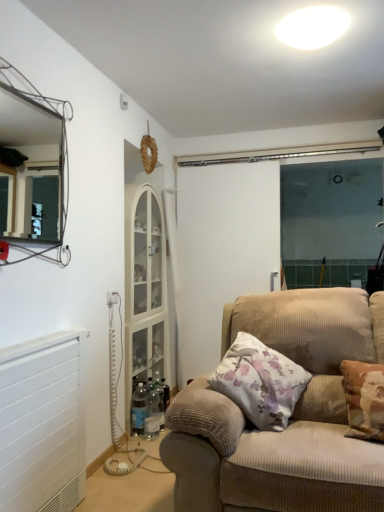
What do you see at coordinates (312, 27) in the screenshot?
I see `white glossy ceiling light at upper center` at bounding box center [312, 27].

This screenshot has height=512, width=384. What do you see at coordinates (31, 169) in the screenshot? I see `metallic wire frame mirror at upper left` at bounding box center [31, 169].

You are a GUI agent. You are given a task and a screenshot of the screen. Output one action in this format:
    pyautogui.click(x=<x>, y=<y>)
    Task: Click on the metallic wire frame mirror at upper left
    The height and width of the screenshot is (512, 384).
    Given the screenshot: What is the action you would take?
    pyautogui.click(x=31, y=169)

What do you see at coordinates (260, 382) in the screenshot?
I see `white floral cushion at right` at bounding box center [260, 382].

The width and height of the screenshot is (384, 512). Find the location of `white plastic radiator at lower left`. white plastic radiator at lower left is located at coordinates (43, 423).

Find the location of a particular element. This screenshot has height=512, width=384. white glossy ceiling light at upper center is located at coordinates (312, 27).

From a real-world perspective, does beige corduroy couch at center stand above white plastic radiator at lower left?

Yes, from a real-world perspective, beige corduroy couch at center is above white plastic radiator at lower left.

Can you confirm if beige corduroy couch at center is taller than white plastic radiator at lower left?

Correct, beige corduroy couch at center is much taller as white plastic radiator at lower left.

Which is in front, point (239, 418) or point (31, 411)?

The point (239, 418) is in front.

Is beige corduroy couch at center not near white plastic radiator at lower left?

beige corduroy couch at center is actually quite close to white plastic radiator at lower left.

Find the location of a particular element. The width and height of the screenshot is (384, 512). radiator below the white plastic electric outlet at lower left (from the image's perspective) is located at coordinates (43, 423).

From a real-world perspective, is white plastic electric outlet at lower left over white plastic radiator at lower left?

Yes, from a real-world perspective, white plastic electric outlet at lower left is on top of white plastic radiator at lower left.

In the scene shown: Considering the relative positions of white plastic electric outlet at lower left and white plastic radiator at lower left in the image provided, is white plastic electric outlet at lower left to the left of white plastic radiator at lower left from the viewer's perspective?

No, white plastic electric outlet at lower left is not to the left of white plastic radiator at lower left.

Between metallic wire frame mirror at upper left and white plastic radiator at lower left, which one appears on the left side from the viewer's perspective?

metallic wire frame mirror at upper left.

Would you say metallic wire frame mirror at upper left is a long distance from white plastic radiator at lower left?

Yes.

Considering the sizes of objects metallic wire frame mirror at upper left and white plastic radiator at lower left in the image provided, who is wider, metallic wire frame mirror at upper left or white plastic radiator at lower left?

Wider between the two is white plastic radiator at lower left.

Does metallic wire frame mirror at upper left have a greater height compared to white plastic radiator at lower left?

Yes.

Is white plastic radiator at lower left facing towards white glossy ceiling light at upper center?

No, white plastic radiator at lower left does not turn towards white glossy ceiling light at upper center.

Considering the sizes of objects white plastic radiator at lower left and white glossy ceiling light at upper center in the image provided, who is smaller, white plastic radiator at lower left or white glossy ceiling light at upper center?

Smaller between the two is white glossy ceiling light at upper center.

Is white plastic radiator at lower left shorter than white glossy ceiling light at upper center?

Incorrect, the height of white plastic radiator at lower left does not fall short of that of white glossy ceiling light at upper center.

Which object is positioned more to the right, white plastic radiator at lower left or white glossy ceiling light at upper center?

white glossy ceiling light at upper center is more to the right.

Find the location of a particular element. light above the beige corduroy couch at center (from a real-world perspective) is located at coordinates (312, 27).

Considering the sizes of beige corduroy couch at center and white glossy ceiling light at upper center in the image, is beige corduroy couch at center taller or shorter than white glossy ceiling light at upper center?

In the image, beige corduroy couch at center appears to be taller than white glossy ceiling light at upper center.

Is beige corduroy couch at center with metallic wire frame mirror at upper left?

beige corduroy couch at center and metallic wire frame mirror at upper left are clearly separated.

What's the angular difference between beige corduroy couch at center and metallic wire frame mirror at upper left's facing directions?

The facing directions of beige corduroy couch at center and metallic wire frame mirror at upper left are 90 degrees apart.

Does beige corduroy couch at center appear on the right side of metallic wire frame mirror at upper left?

Indeed, beige corduroy couch at center is positioned on the right side of metallic wire frame mirror at upper left.

Does point (340, 470) come closer to viewer compared to point (20, 150)?

Yes, point (340, 470) is in front of point (20, 150).

Considering the sizes of objects white floral cushion at right and white plastic radiator at lower left in the image provided, who is shorter, white floral cushion at right or white plastic radiator at lower left?

white floral cushion at right is shorter.

Which of these two, white floral cushion at right or white plastic radiator at lower left, is thinner?

white plastic radiator at lower left is thinner.

Is white plastic radiator at lower left at the back of white floral cushion at right?

No, white floral cushion at right is not facing away from white plastic radiator at lower left.

In the scene shown: From the image's perspective, between white floral cushion at right and white plastic radiator at lower left, which one is located above?

white floral cushion at right.

Where is `studio couch located above the white plastic radiator at lower left (from the image's perspective)`? studio couch located above the white plastic radiator at lower left (from the image's perspective) is located at coordinates (291, 417).

Locate an element on the screen. Image resolution: width=384 pixels, height=512 pixels. radiator lying on the left of white plastic electric outlet at lower left is located at coordinates (43, 423).

Which object lies further to the anchor point beige corduroy couch at center, white glossy ceiling light at upper center or white plastic electric outlet at lower left?

Among the two, white glossy ceiling light at upper center is located further to beige corduroy couch at center.

Based on their spatial positions, is white plastic electric outlet at lower left or beige corduroy couch at center closer to metallic wire frame mirror at upper left?

white plastic electric outlet at lower left.

Looking at the image, which one is located closer to white glossy ceiling light at upper center, metallic wire frame mirror at upper left or white floral cushion at right?

white floral cushion at right is positioned closer to the anchor white glossy ceiling light at upper center.

When comparing their distances from white floral cushion at right, does beige corduroy couch at center or metallic wire frame mirror at upper left seem closer?

The object closer to white floral cushion at right is beige corduroy couch at center.

From the picture: From the image, which object appears to be farther from white floral cushion at right, metallic wire frame mirror at upper left or beige corduroy couch at center?

metallic wire frame mirror at upper left is positioned further to the anchor white floral cushion at right.

Estimate the real-world distances between objects in this image. Which object is further from white plastic radiator at lower left, white floral cushion at right or beige corduroy couch at center?

white floral cushion at right lies further to white plastic radiator at lower left than the other object.

From the image, which object appears to be nearer to white plastic radiator at lower left, white floral cushion at right or white glossy ceiling light at upper center?

white floral cushion at right is closer to white plastic radiator at lower left.

Estimate the real-world distances between objects in this image. Which object is closer to white plastic electric outlet at lower left, metallic wire frame mirror at upper left or white plastic radiator at lower left?

white plastic radiator at lower left.

Locate an element on the screen. This screenshot has height=512, width=384. pillow between white plastic radiator at lower left and white plastic electric outlet at lower left from front to back is located at coordinates (260, 382).

Where is `mirror between white glossy ceiling light at upper center and white plastic radiator at lower left in the up-down direction`? The height and width of the screenshot is (512, 384). mirror between white glossy ceiling light at upper center and white plastic radiator at lower left in the up-down direction is located at coordinates (31, 169).

The height and width of the screenshot is (512, 384). Identify the location of mirror positioned between beige corduroy couch at center and white plastic electric outlet at lower left from near to far. (31, 169).

Locate an element on the screen. The height and width of the screenshot is (512, 384). studio couch between white glossy ceiling light at upper center and white plastic radiator at lower left from top to bottom is located at coordinates coord(291,417).